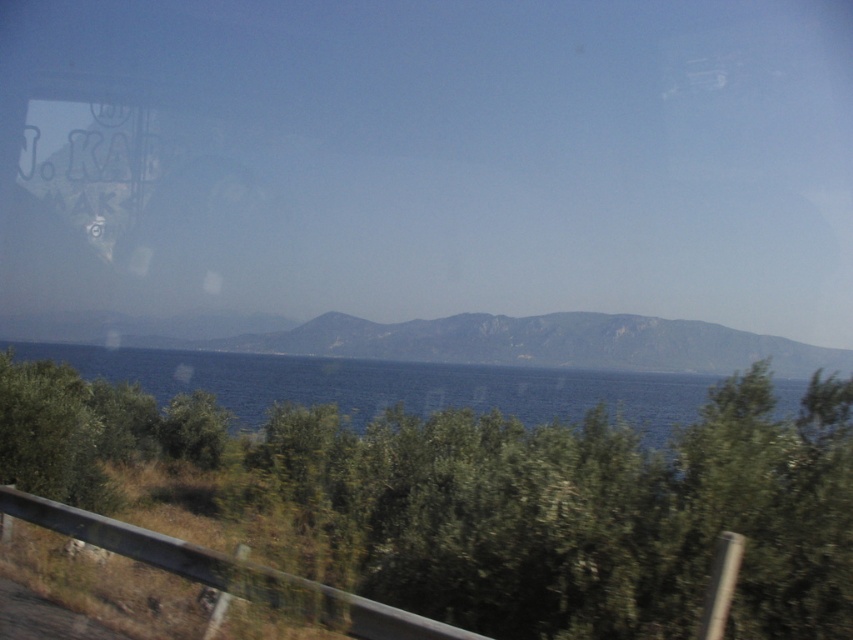
Question: Which of the following is the closest to the observer?

Choices:
 (A) green leafy tree at lower center
 (B) green rocky mountain at center

Answer: (A)

Question: Is green leafy tree at lower center positioned before green rocky mountain at center?

Choices:
 (A) yes
 (B) no

Answer: (A)

Question: Is green rocky mountain at center in front of blue water at center?

Choices:
 (A) no
 (B) yes

Answer: (A)

Question: Which is farther from the green leafy tree at lower center?

Choices:
 (A) green rocky mountain at center
 (B) blue water at center

Answer: (A)

Question: Does green leafy tree at lower center come in front of blue water at center?

Choices:
 (A) no
 (B) yes

Answer: (B)

Question: Estimate the real-world distances between objects in this image. Which object is closer to the blue water at center?

Choices:
 (A) green rocky mountain at center
 (B) green leafy tree at lower center

Answer: (A)